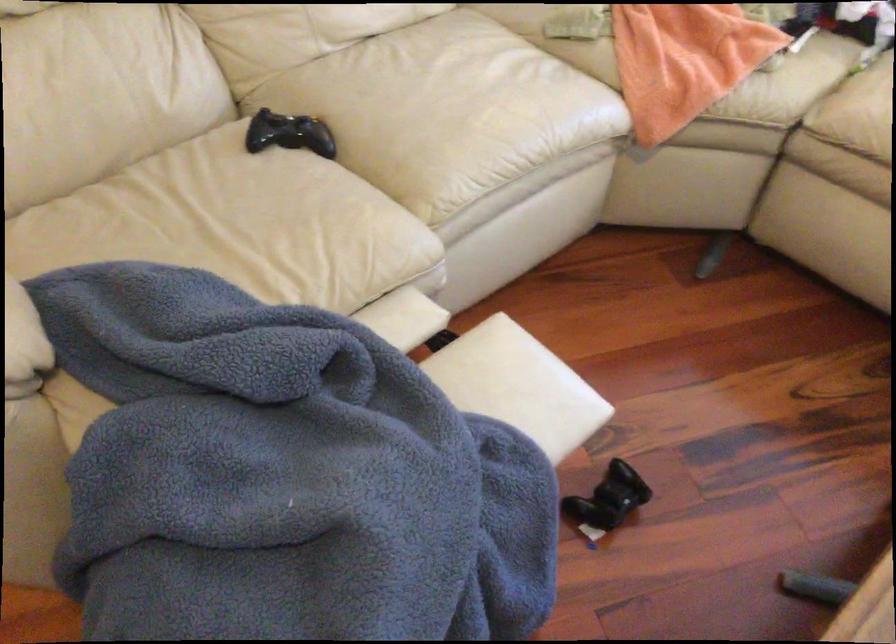
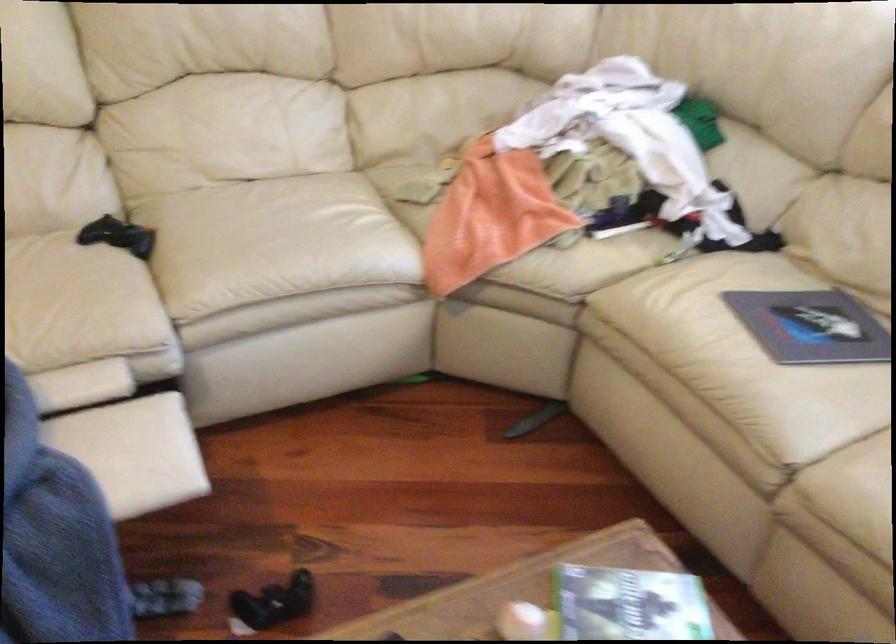
Question: Which direction would the cameraman need to move to produce the second image? Reply with the corresponding letter.

Choices:
 (A) Left
 (B) Right
 (C) Forward
 (D) Backward

Answer: (B)